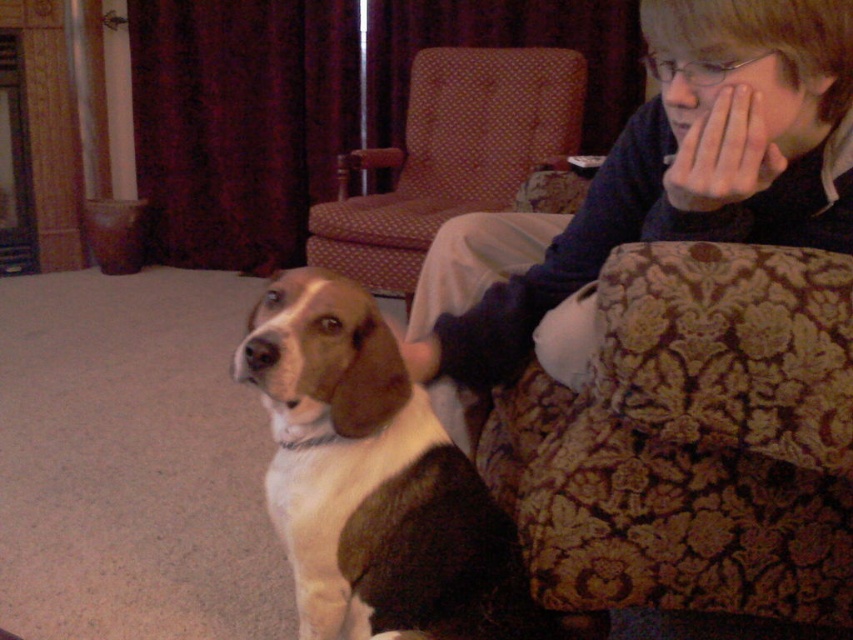
Does matte blue sweater at upper right have a greater width compared to patterned fabric armchair at center?

In fact, matte blue sweater at upper right might be narrower than patterned fabric armchair at center.

Who is lower down, matte blue sweater at upper right or patterned fabric armchair at center?

matte blue sweater at upper right

You are a GUI agent. You are given a task and a screenshot of the screen. Output one action in this format:
    pyautogui.click(x=<x>, y=<y>)
    Task: Click on the matte blue sweater at upper right
    
    Given the screenshot: What is the action you would take?
    pyautogui.click(x=653, y=192)

Identify the location of matte blue sweater at upper right. (653, 192).

Can you confirm if matte blue sweater at upper right is positioned above tri-color fur dog at center?

Yes.

Can you confirm if matte blue sweater at upper right is positioned below tri-color fur dog at center?

No.

Which is behind, point (509, 323) or point (303, 538)?

Positioned behind is point (509, 323).

This screenshot has height=640, width=853. I want to click on matte blue sweater at upper right, so click(x=653, y=192).

Does tri-color fur dog at center appear over patterned fabric armchair at center?

No, tri-color fur dog at center is not above patterned fabric armchair at center.

Does tri-color fur dog at center have a larger size compared to patterned fabric armchair at center?

Actually, tri-color fur dog at center might be smaller than patterned fabric armchair at center.

What do you see at coordinates (376, 483) in the screenshot?
I see `tri-color fur dog at center` at bounding box center [376, 483].

The width and height of the screenshot is (853, 640). I want to click on tri-color fur dog at center, so click(x=376, y=483).